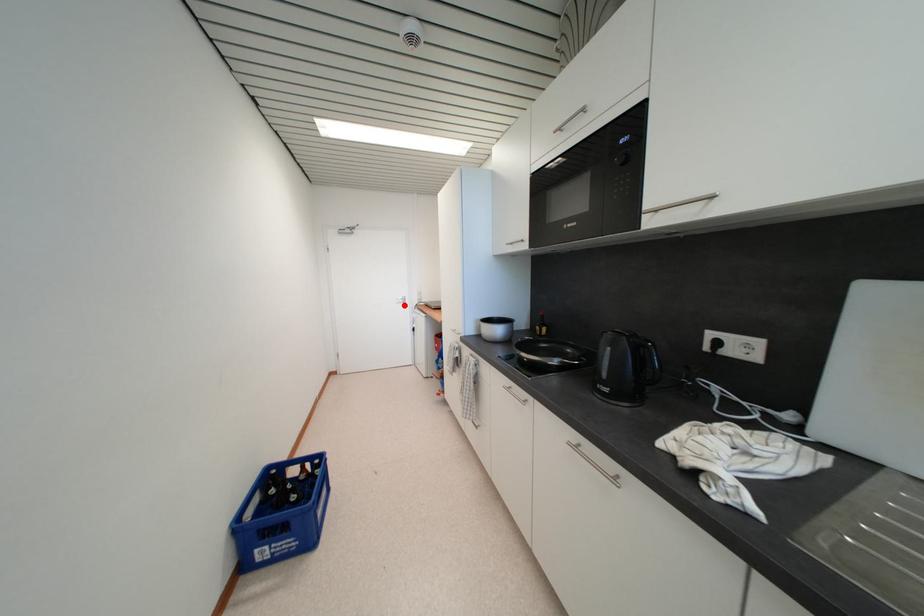
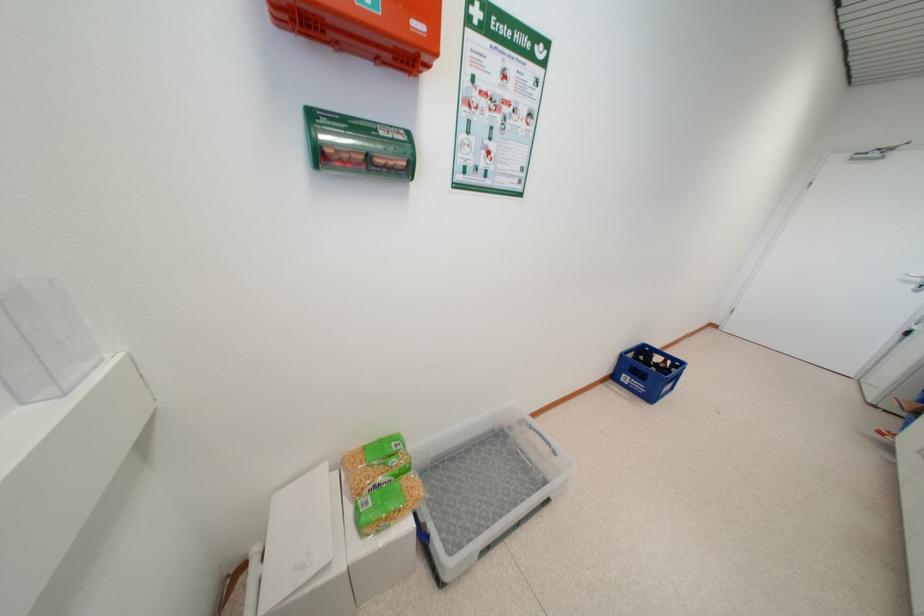
Find the pixel in the second image that matches the highlighted location in the first image.

(912, 284)